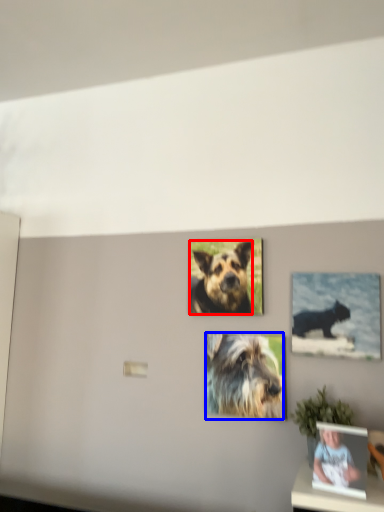
Question: Which object is further to the camera taking this photo, dog (highlighted by a red box) or dog (highlighted by a blue box)?

Choices:
 (A) dog
 (B) dog

Answer: (A)